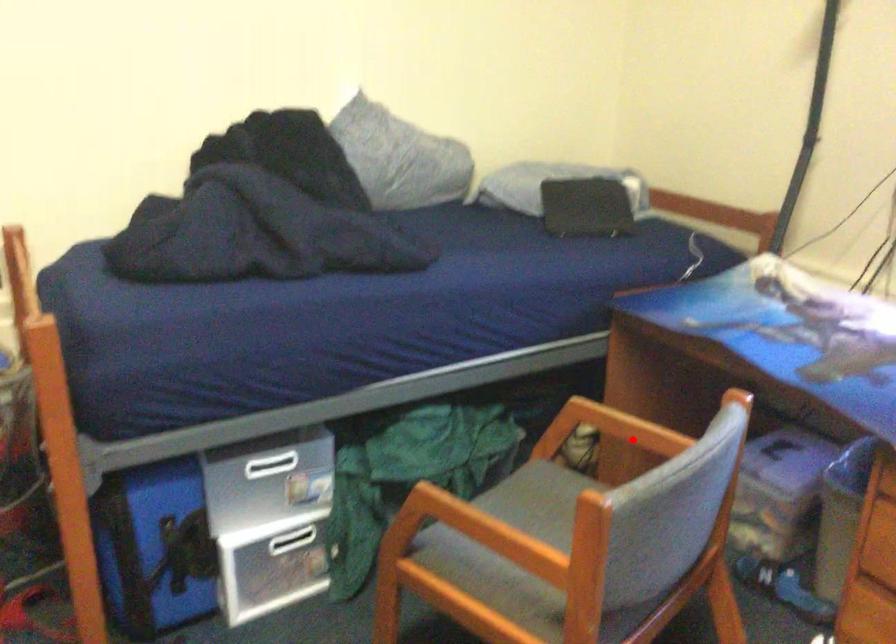
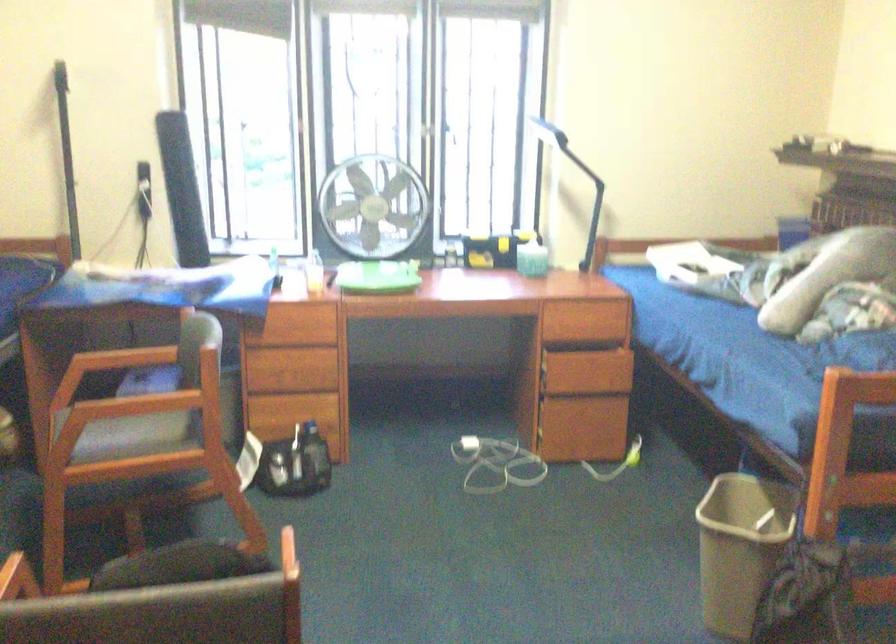
Where in the second image is the point corresponding to the highlighted location from the first image?

(128, 357)